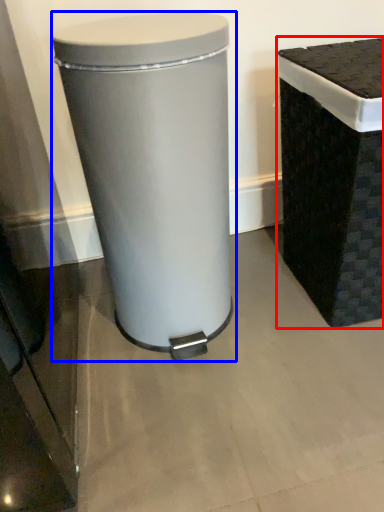
Question: Which point is closer to the camera, waste container (highlighted by a red box) or waste container (highlighted by a blue box)?

Choices:
 (A) waste container
 (B) waste container

Answer: (B)